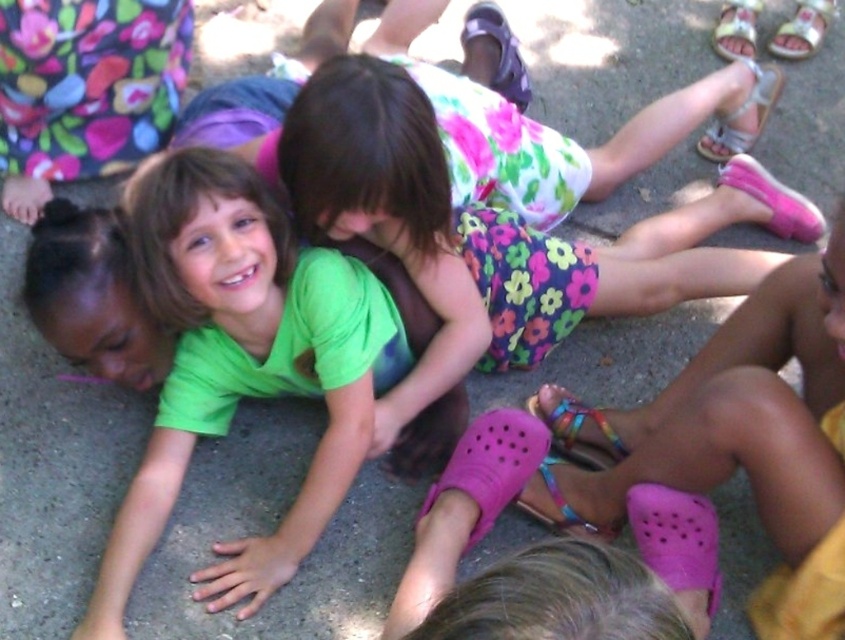
You are standing in the scene and want to take a photo of the point at coordinates (x=804, y=218). The camera you are using has a minimum focus distance of 2 meters. Will the camera be able to focus on the point?

The point at coordinates (x=804, y=218) is 2.21 meters away from the camera. Since the minimum focus distance is 2 meters, the camera can focus on the point because it is beyond the minimum required distance.